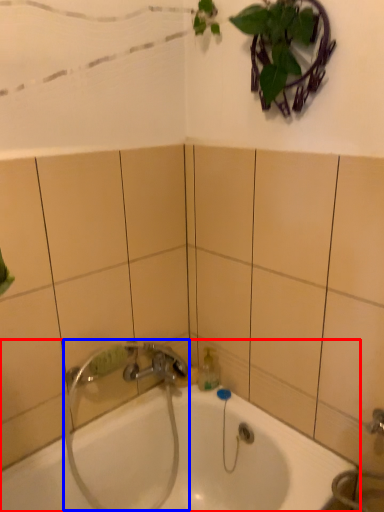
Question: Which object is closer to the camera taking this photo, bathtub (highlighted by a red box) or plumbing fixture (highlighted by a blue box)?

Choices:
 (A) bathtub
 (B) plumbing fixture

Answer: (A)